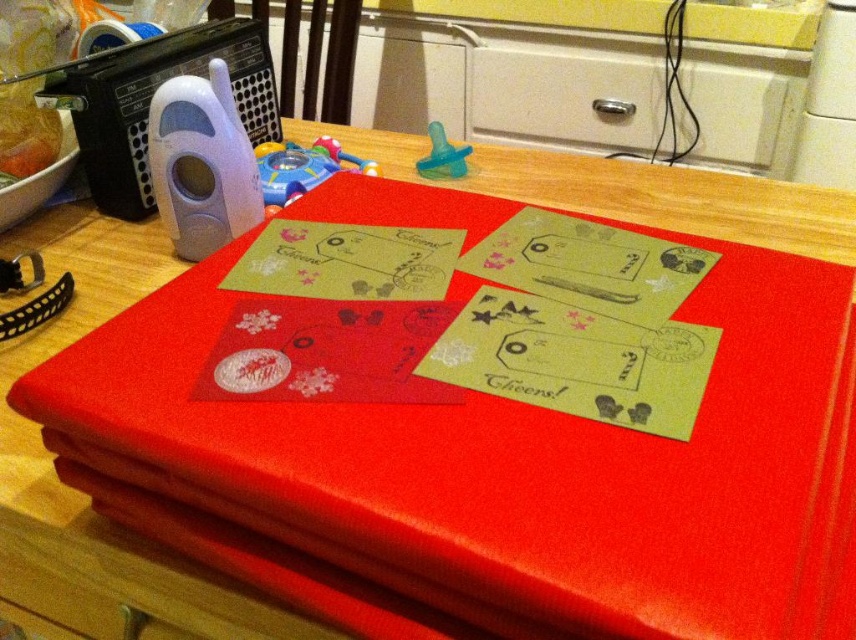
You are standing 5 feet away from the camera. Is the point at coordinates point (702, 134) closer to you than the camera?

The point at coordinates point (702, 134) is 5.68 feet away from the camera. Since you are standing 5 feet away from the camera, the point is farther from you than the camera is.

You are organizing a toy storage box and need to place the translucent plastic toy at center and the teal rubber pacifier at upper center inside. If the box has a width of 10 cm, which item will definitely fit without needing to be compressed?

The teal rubber pacifier at upper center will definitely fit in the 10 cm wide box since it is smaller in width than the translucent plastic toy at center.

You are organizing items on a table and need to place a new object between the white plastic remote control at upper left and the teal rubber pacifier at upper center. Considering their positions, which object should the new object be placed closer to?

The new object should be placed closer to the teal rubber pacifier at upper center because the white plastic remote control at upper left is closer to the viewer, meaning the pacifier is farther back, so placing the new object closer to the pacifier would maintain the spatial relationship.